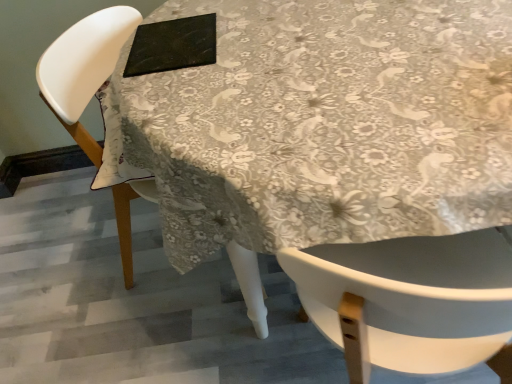
Identify the location of free spot to the right of black matte pad at upper center. (x=229, y=28).